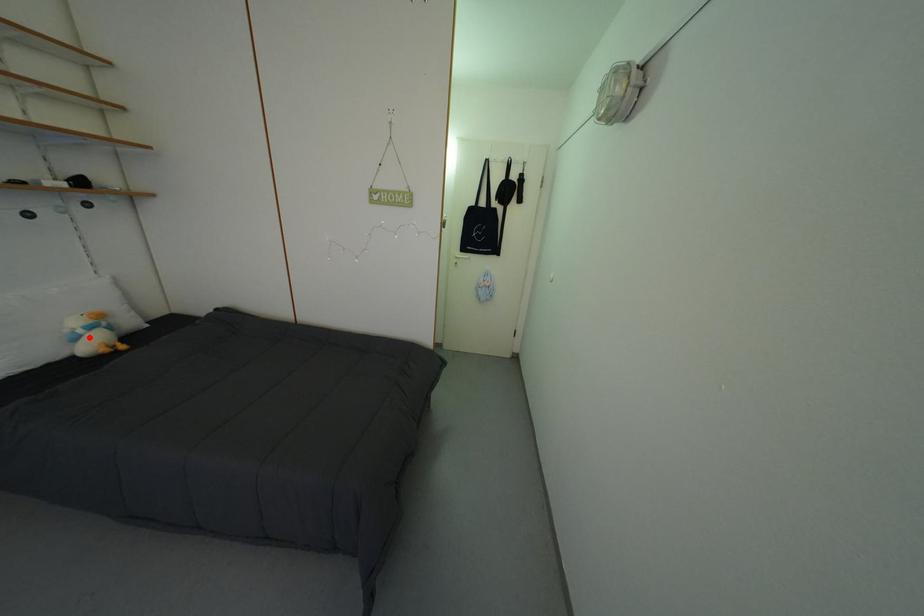
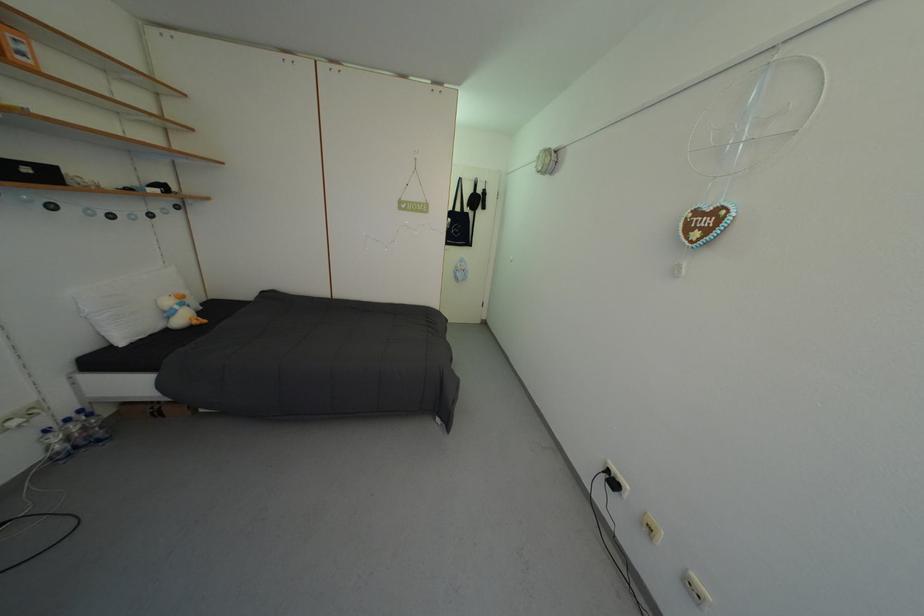
Question: I am providing you with two images of the same scene from different viewpoints. A red point is shown in image1. For the corresponding object point in image2, is it positioned nearer or farther from the camera?

Choices:
 (A) Nearer
 (B) Farther

Answer: (A)